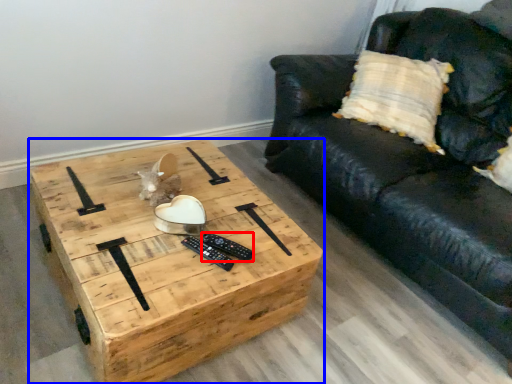
Question: Which object appears farthest to the camera in this image, remote (highlighted by a red box) or coffee table (highlighted by a blue box)?

Choices:
 (A) remote
 (B) coffee table

Answer: (A)